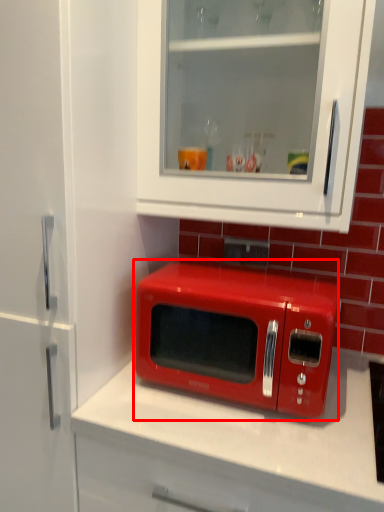
Question: From the image's perspective, considering the relative positions of microwave oven (annotated by the red box) and cabinetry in the image provided, where is microwave oven (annotated by the red box) located with respect to the staircase?

Choices:
 (A) below
 (B) above

Answer: (A)